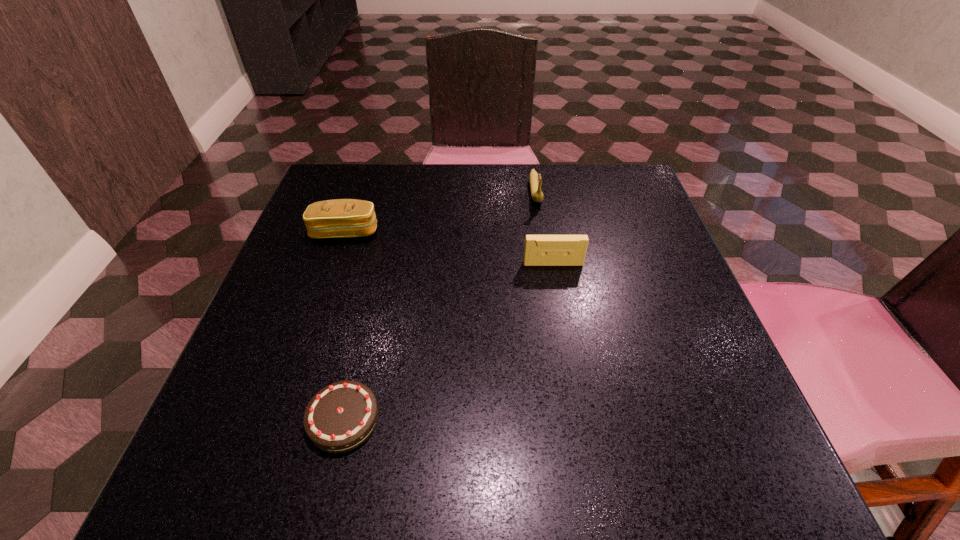
I want to click on the tallest object, so click(535, 179).

What are the coordinates of `the farthest object` in the screenshot? It's located at (535, 179).

Where is `clutch bag`? The image size is (960, 540). clutch bag is located at coordinates (341, 218).

Where is `videotape`? videotape is located at coordinates click(540, 250).

You are a GUI agent. You are given a task and a screenshot of the screen. Output one action in this format:
    pyautogui.click(x=<x>, y=<y>)
    Task: Click on the shortest object
    
    Given the screenshot: What is the action you would take?
    pyautogui.click(x=340, y=417)

Find the location of a particular element. Image resolution: width=960 pixels, height=540 pixels. chocolate cake is located at coordinates (340, 417).

At what (x,y) coordinates should I click in order to perform the action: click on free space located at the stem of the banana. Please return your answer as a coordinate pair (x, y). This screenshot has width=960, height=540. Looking at the image, I should click on (553, 304).

Locate an element on the screen. Image resolution: width=960 pixels, height=540 pixels. vacant area located on the zipper side of the third nearest object is located at coordinates (332, 271).

The width and height of the screenshot is (960, 540). In order to click on vacant area situated 0.340m at the front of the videotape with spools in this screenshot , I will do `click(581, 423)`.

This screenshot has height=540, width=960. In order to click on free location located 0.100m on the back of the nearest object in this screenshot , I will do `click(363, 336)`.